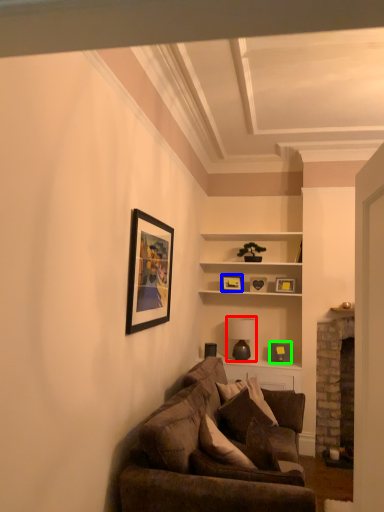
Question: Based on their relative distances, which object is farther from lamp (highlighted by a red box)? Choose from picture frame (highlighted by a blue box) and picture frame (highlighted by a green box).

Choices:
 (A) picture frame
 (B) picture frame

Answer: (A)